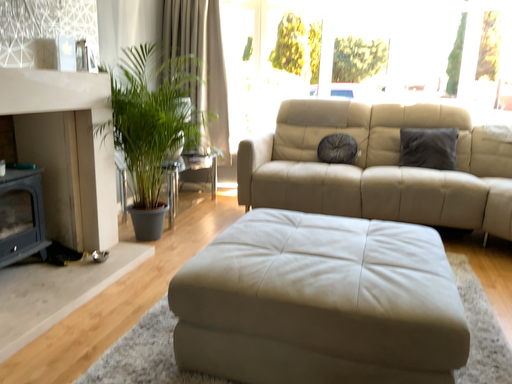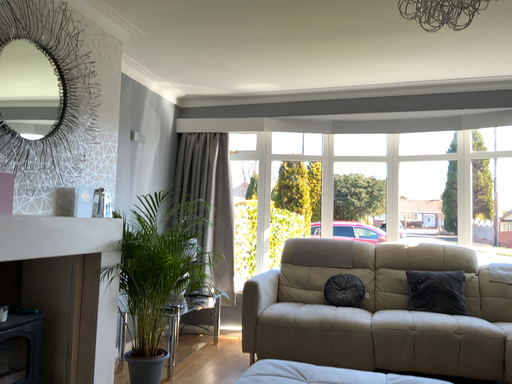
Question: How did the camera likely rotate when shooting the video?

Choices:
 (A) rotated upward
 (B) rotated downward

Answer: (A)